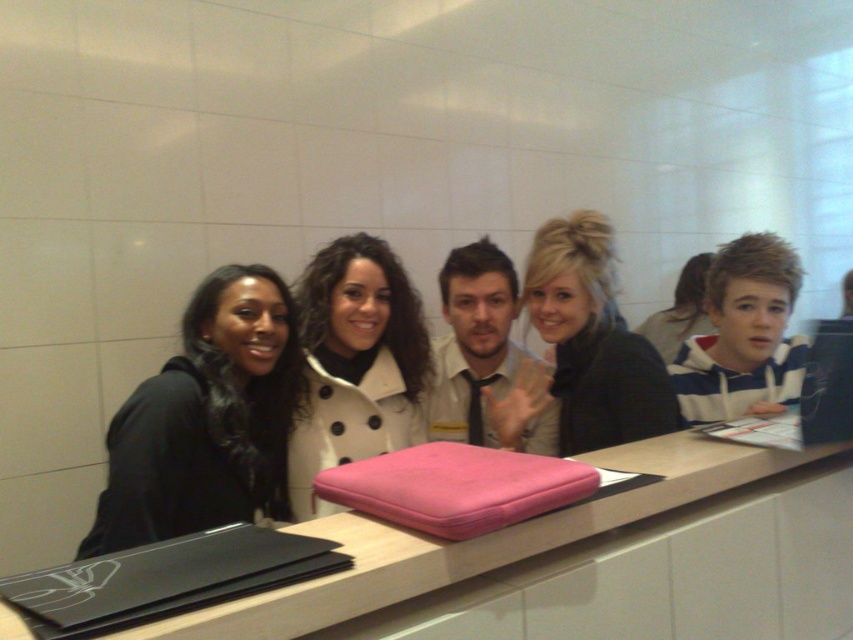
You are standing in the room and want to move from the point at coordinate [589,442] to the point at coordinate [474,419]. Since you can only move forward, will you be able to reach the second point without changing direction?

Yes, because point [589,442] is in front of point [474,419], so moving forward directly towards the second point would allow you to reach it without needing to change direction.